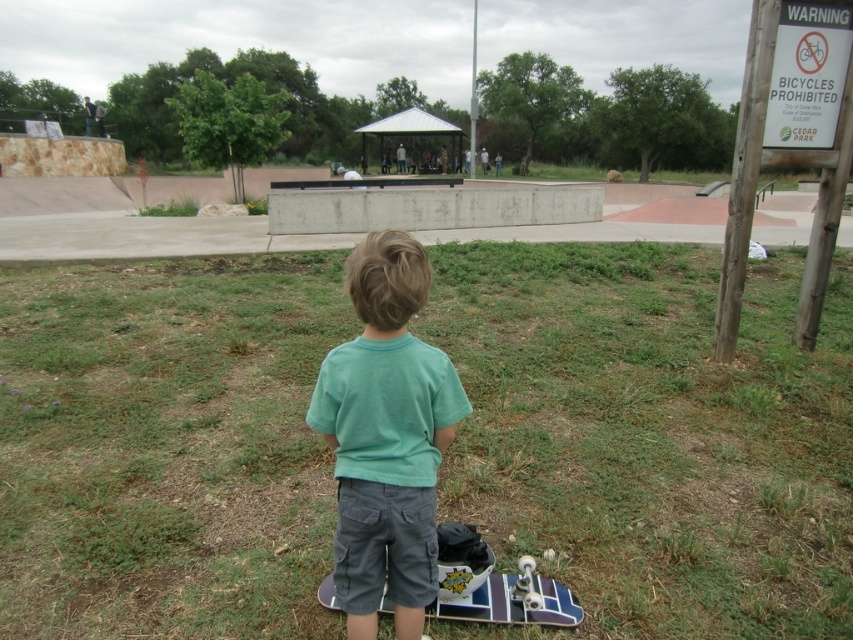
You are a photographer at the skate park and want to capture both the green grass at lower center and the green cotton shirt at center in a single photo. Which object will take up more space in the photo?

The green grass at lower center will take up more space in the photo because it is larger in size than the green cotton shirt at center.

You are a photographer trying to capture a candid shot of the green cotton shirt at center without including the green grass at lower center in the frame. Based on their positions, is this possible?

The green grass at lower center is positioned over the green cotton shirt at center, so it would be difficult to capture the green cotton shirt at center without including the green grass at lower center in the frame.

You are a photographer trying to capture a candid shot of the green cotton shirt at center without including the green grass at lower center in the frame. Based on their heights, is this possible?

The green grass at lower center is taller than the green cotton shirt at center, so it would be difficult to capture the green cotton shirt at center without including the green grass at lower center in the frame because the grass is taller and might obstruct the view.